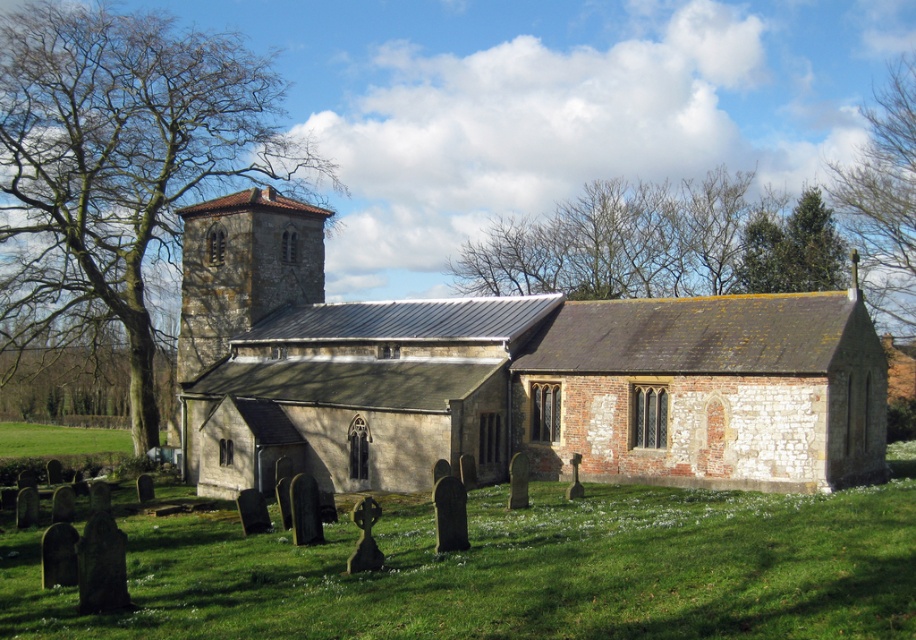
Based on the photo, you are a landscape architect designing a walking path that needs to pass between the green leafy tree at upper left and the green evergreen tree at upper right. Based on their widths, which tree requires more space on the path?

The green leafy tree at upper left might require more space on the path since it might be wider than the green evergreen tree at upper right according to the description.

You are standing at the entrance of the historic stone church and want to take a photo of the green leafy tree at upper left. According to the coordinates provided, where should you position yourself to capture the tree in the frame?

The green leafy tree at upper left is located at coordinates point (118, 168), so you should position yourself at the entrance and aim your camera towards the upper left direction to capture the tree in the frame.